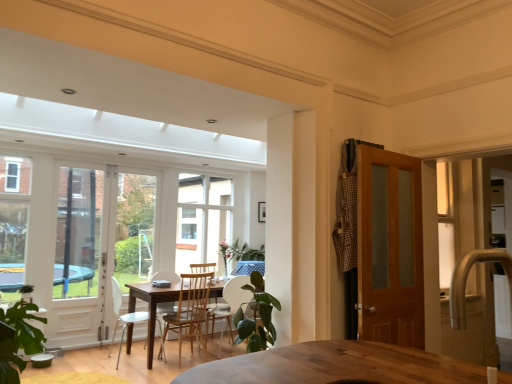
Question: Would you say wooden chair at center, the third chair when ordered from left to right, is inside or outside white glass window at center?

Choices:
 (A) outside
 (B) inside

Answer: (A)

Question: In the image, is wooden chair at center, the third chair when ordered from left to right, positioned in front of or behind white glass window at center?

Choices:
 (A) behind
 (B) front

Answer: (B)

Question: Which object is positioned closest to the wooden chair at center, which appears as the 2th chair when viewed from the left?

Choices:
 (A) gold textured faucet at right
 (B) wooden chair at center, the third chair when ordered from left to right
 (C) light brown wooden table at center
 (D) wooden door at right
 (E) metallic silver table at center

Answer: (C)

Question: Which object is the closest to the green leafy plant at center?

Choices:
 (A) white glass window at center
 (B) white glass screen door at left
 (C) wooden door at right
 (D) light brown wooden table at center
 (E) wooden chair at center, marked as the 1th chair in a right-to-left arrangement

Answer: (C)